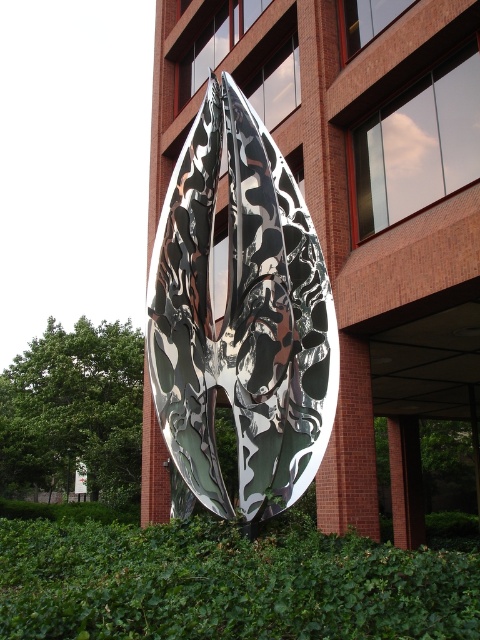
You are standing in front of the modern sculpture and want to take a photo that includes both the sculpture and the green leafy hedge at center. Based on their positions, where should you position yourself to capture both elements in the frame?

Since the green leafy hedge at center is located at point (226, 584), you should position yourself in front of the sculpture, slightly to the right side to ensure both the sculpture and the hedge are within the frame.

Consider the image. You are an artist planning to photograph the metallic reflective leaf at center and the green leafy hedge at center. You want both objects to be in focus simultaneously. Given that your camera can only focus on objects within a 10 feet range, will you need to adjust your position or settings?

The metallic reflective leaf at center and green leafy hedge at center are 15.35 feet apart, which exceeds the camera focus range of 10 feet. Therefore, you will need to adjust your position or settings to ensure both are in focus.

Looking at this image, you are standing in front of the sculpture and want to take a photo of the green leafy hedge at center without the metallic reflective leaf at center blocking the view. Is this possible?

The green leafy hedge at center is behind the metallic reflective leaf at center, so it is blocked by the leaf. Therefore, you cannot take a photo of the green leafy hedge at center without the metallic reflective leaf at center blocking the view.